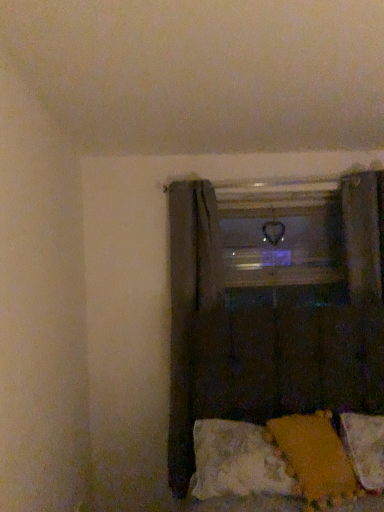
In order to face dark fabric curtain at lower right, the 2th curtain when ordered from back to front, should I rotate leftwards or rightwards?

A 20.430 degree turn to the right will do.

Where is `textured yellow fabric at lower right`? textured yellow fabric at lower right is located at coordinates (272, 466).

The image size is (384, 512). Describe the element at coordinates (191, 315) in the screenshot. I see `dark fabric curtain at center, which is the second curtain in front-to-back order` at that location.

What is the approximate height of velvety orange pillow at lower right, acting as the 2th pillow starting from the right?

The height of velvety orange pillow at lower right, acting as the 2th pillow starting from the right, is 29.83 centimeters.

Locate an element on the screen. The width and height of the screenshot is (384, 512). transparent glass window frame at center is located at coordinates (282, 246).

Considering the sizes of textured yellow fabric at lower right and dark fabric curtain at lower right, which is counted as the first curtain, starting from the front, in the image, is textured yellow fabric at lower right bigger or smaller than dark fabric curtain at lower right, which is counted as the first curtain, starting from the front,?

Considering their sizes, textured yellow fabric at lower right takes up less space than dark fabric curtain at lower right, which is counted as the first curtain, starting from the front.

Looking at this image, from a real-world perspective, is textured yellow fabric at lower right physically located above or below dark fabric curtain at lower right, which is counted as the first curtain, starting from the front?

From a real-world perspective, textured yellow fabric at lower right is physically below dark fabric curtain at lower right, which is counted as the first curtain, starting from the front.

Does textured yellow fabric at lower right have a lesser height compared to dark fabric curtain at lower right, the 2th curtain when ordered from back to front?

Yes, textured yellow fabric at lower right is shorter than dark fabric curtain at lower right, the 2th curtain when ordered from back to front.

Is textured yellow fabric at lower right to the left or to the right of dark fabric curtain at lower right, the 2th curtain when ordered from back to front, in the image?

Clearly, textured yellow fabric at lower right is on the left of dark fabric curtain at lower right, the 2th curtain when ordered from back to front, in the image.

From the image's perspective, is dark fabric curtain at lower right, the 2th curtain when ordered from back to front, above dark fabric curtain at center, which ranks as the first curtain in back-to-front order?

No, from the image's perspective, dark fabric curtain at lower right, the 2th curtain when ordered from back to front, is not above dark fabric curtain at center, which ranks as the first curtain in back-to-front order.

Is dark fabric curtain at lower right, which is counted as the first curtain, starting from the front, positioned behind dark fabric curtain at center, which is the second curtain in front-to-back order?

No, dark fabric curtain at lower right, which is counted as the first curtain, starting from the front, is in front of dark fabric curtain at center, which is the second curtain in front-to-back order.

Does dark fabric curtain at lower right, the 2th curtain when ordered from back to front, turn towards dark fabric curtain at center, which ranks as the first curtain in back-to-front order?

No.

Does point (177, 274) lie behind point (199, 311)?

Yes, it is.

Is velvety orange pillow at lower right, acting as the 2th pillow starting from the right, facing towards textured yellow fabric at lower right?

Yes, velvety orange pillow at lower right, acting as the 2th pillow starting from the right, is oriented towards textured yellow fabric at lower right.

Is textured yellow fabric at lower right inside velvety orange pillow at lower right, acting as the 2th pillow starting from the right?

Yes, textured yellow fabric at lower right is a part of velvety orange pillow at lower right, acting as the 2th pillow starting from the right.

Is velvety orange pillow at lower right, positioned as the first pillow in left-to-right order, bigger or smaller than textured yellow fabric at lower right?

In the image, velvety orange pillow at lower right, positioned as the first pillow in left-to-right order, appears to be smaller than textured yellow fabric at lower right.

From a real-world perspective, is velvety orange pillow at lower right, acting as the 2th pillow starting from the right, under textured yellow fabric at lower right?

No, from a real-world perspective, velvety orange pillow at lower right, acting as the 2th pillow starting from the right, is not beneath textured yellow fabric at lower right.

Is velvety orange pillow at lower right, positioned as the first pillow in left-to-right order, aimed at dark fabric curtain at center, which ranks as the first curtain in back-to-front order?

No, velvety orange pillow at lower right, positioned as the first pillow in left-to-right order, is not oriented towards dark fabric curtain at center, which ranks as the first curtain in back-to-front order.

From a real-world perspective, which is physically below, velvety orange pillow at lower right, acting as the 2th pillow starting from the right, or dark fabric curtain at center, which ranks as the first curtain in back-to-front order?

velvety orange pillow at lower right, acting as the 2th pillow starting from the right.

Does point (342, 469) lie in front of point (205, 221)?

That is True.

Considering the sizes of objects velvety orange pillow at lower right, acting as the 2th pillow starting from the right, and dark fabric curtain at center, which is the second curtain in front-to-back order, in the image provided, who is thinner, velvety orange pillow at lower right, acting as the 2th pillow starting from the right, or dark fabric curtain at center, which is the second curtain in front-to-back order,?

dark fabric curtain at center, which is the second curtain in front-to-back order, is thinner.

Would you consider transparent glass window frame at center to be distant from textured yellow fabric at lower right?

That's right, there is a large distance between transparent glass window frame at center and textured yellow fabric at lower right.

Does point (311, 209) appear closer or farther from the camera than point (286, 507)?

Point (311, 209) is positioned farther from the camera compared to point (286, 507).

Considering their positions, is transparent glass window frame at center located in front of or behind textured yellow fabric at lower right?

Visually, transparent glass window frame at center is located behind textured yellow fabric at lower right.

Image resolution: width=384 pixels, height=512 pixels. Find the location of `bed in front of the transparent glass window frame at center`. bed in front of the transparent glass window frame at center is located at coordinates (272, 466).

Could you tell me if dark fabric curtain at center, which ranks as the first curtain in back-to-front order, is facing velvety orange pillow at lower right, positioned as the first pillow in left-to-right order?

No, dark fabric curtain at center, which ranks as the first curtain in back-to-front order, is not turned towards velvety orange pillow at lower right, positioned as the first pillow in left-to-right order.

Considering the relative sizes of dark fabric curtain at center, which is the second curtain in front-to-back order, and velvety orange pillow at lower right, positioned as the first pillow in left-to-right order, in the image provided, is dark fabric curtain at center, which is the second curtain in front-to-back order, thinner than velvety orange pillow at lower right, positioned as the first pillow in left-to-right order,?

Yes, dark fabric curtain at center, which is the second curtain in front-to-back order, is thinner than velvety orange pillow at lower right, positioned as the first pillow in left-to-right order.

Can we say dark fabric curtain at center, which is the second curtain in front-to-back order, lies outside velvety orange pillow at lower right, positioned as the first pillow in left-to-right order?

Absolutely, dark fabric curtain at center, which is the second curtain in front-to-back order, is external to velvety orange pillow at lower right, positioned as the first pillow in left-to-right order.

From their relative heights in the image, would you say dark fabric curtain at center, which ranks as the first curtain in back-to-front order, is taller or shorter than velvety orange pillow at lower right, positioned as the first pillow in left-to-right order?

Considering their sizes, dark fabric curtain at center, which ranks as the first curtain in back-to-front order, has more height than velvety orange pillow at lower right, positioned as the first pillow in left-to-right order.

Is white soft pillow at lower right, which is the second pillow from left to right, completely or partially inside velvety orange pillow at lower right, positioned as the first pillow in left-to-right order?

No, velvety orange pillow at lower right, positioned as the first pillow in left-to-right order, does not contain white soft pillow at lower right, which is the second pillow from left to right.

Consider the image. Is velvety orange pillow at lower right, positioned as the first pillow in left-to-right order, turned away from white soft pillow at lower right, which is the second pillow from left to right?

No, velvety orange pillow at lower right, positioned as the first pillow in left-to-right order, is not facing the opposite direction of white soft pillow at lower right, which is the second pillow from left to right.

Can you tell me how much velvety orange pillow at lower right, acting as the 2th pillow starting from the right, and white soft pillow at lower right, which is the second pillow from left to right, differ in facing direction?

18.1 degrees.

You are a GUI agent. You are given a task and a screenshot of the screen. Output one action in this format:
    pyautogui.click(x=<x>, y=<y>)
    Task: Click on the bed behind the dark fabric curtain at lower right, the 2th curtain when ordered from back to front
    Image resolution: width=384 pixels, height=512 pixels.
    Given the screenshot: What is the action you would take?
    pyautogui.click(x=272, y=466)

Locate an element on the screen. The width and height of the screenshot is (384, 512). curtain located above the dark fabric curtain at lower right, the 2th curtain when ordered from back to front (from a real-world perspective) is located at coordinates (191, 315).

Considering their positions, is white soft pillow at lower right, the 1th pillow in the right-to-left sequence, positioned closer to dark fabric curtain at lower right, which is counted as the first curtain, starting from the front, than velvety orange pillow at lower right, acting as the 2th pillow starting from the right?

velvety orange pillow at lower right, acting as the 2th pillow starting from the right, is positioned closer to the anchor dark fabric curtain at lower right, which is counted as the first curtain, starting from the front.

From the picture: Looking at the image, which one is located closer to velvety orange pillow at lower right, acting as the 2th pillow starting from the right, transparent glass window frame at center or textured yellow fabric at lower right?

Among the two, textured yellow fabric at lower right is located nearer to velvety orange pillow at lower right, acting as the 2th pillow starting from the right.

From the image, which object appears to be nearer to dark fabric curtain at center, which ranks as the first curtain in back-to-front order, dark fabric curtain at lower right, the 2th curtain when ordered from back to front, or transparent glass window frame at center?

dark fabric curtain at lower right, the 2th curtain when ordered from back to front.

When comparing their distances from transparent glass window frame at center, does velvety orange pillow at lower right, positioned as the first pillow in left-to-right order, or white soft pillow at lower right, the 1th pillow in the right-to-left sequence, seem closer?

white soft pillow at lower right, the 1th pillow in the right-to-left sequence, is positioned closer to the anchor transparent glass window frame at center.

Estimate the real-world distances between objects in this image. Which object is further from textured yellow fabric at lower right, dark fabric curtain at center, which is the second curtain in front-to-back order, or white soft pillow at lower right, the 1th pillow in the right-to-left sequence?

dark fabric curtain at center, which is the second curtain in front-to-back order, is further to textured yellow fabric at lower right.

Which object lies further to the anchor point dark fabric curtain at lower right, the 2th curtain when ordered from back to front, white soft pillow at lower right, which is the second pillow from left to right, or dark fabric curtain at center, which is the second curtain in front-to-back order?

Based on the image, white soft pillow at lower right, which is the second pillow from left to right, appears to be further to dark fabric curtain at lower right, the 2th curtain when ordered from back to front.

From the picture: Based on their spatial positions, is textured yellow fabric at lower right or dark fabric curtain at center, which is the second curtain in front-to-back order, closer to transparent glass window frame at center?

dark fabric curtain at center, which is the second curtain in front-to-back order, is closer to transparent glass window frame at center.

Looking at the image, which one is located closer to textured yellow fabric at lower right, dark fabric curtain at lower right, which is counted as the first curtain, starting from the front, or velvety orange pillow at lower right, positioned as the first pillow in left-to-right order?

The object closer to textured yellow fabric at lower right is velvety orange pillow at lower right, positioned as the first pillow in left-to-right order.

Where is `curtain positioned between dark fabric curtain at lower right, which is counted as the first curtain, starting from the front, and transparent glass window frame at center from near to far`? This screenshot has height=512, width=384. curtain positioned between dark fabric curtain at lower right, which is counted as the first curtain, starting from the front, and transparent glass window frame at center from near to far is located at coordinates (191, 315).

I want to click on pillow between textured yellow fabric at lower right and white soft pillow at lower right, which is the second pillow from left to right, in the horizontal direction, so click(x=315, y=459).

You are a GUI agent. You are given a task and a screenshot of the screen. Output one action in this format:
    pyautogui.click(x=<x>, y=<y>)
    Task: Click on the bed between dark fabric curtain at lower right, the 2th curtain when ordered from back to front, and transparent glass window frame at center from front to back
    The width and height of the screenshot is (384, 512).
    Given the screenshot: What is the action you would take?
    pyautogui.click(x=272, y=466)

Identify the location of bed between transparent glass window frame at center and white soft pillow at lower right, the 1th pillow in the right-to-left sequence, in the vertical direction. The image size is (384, 512). (272, 466).